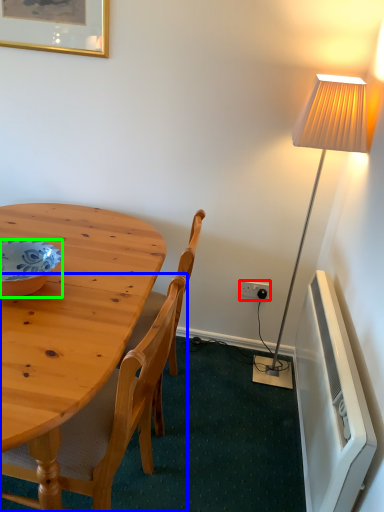
Question: Estimate the real-world distances between objects in this image. Which object is farther from power outlet (highlighted by a red box), chair (highlighted by a blue box) or bowl (highlighted by a green box)?

Choices:
 (A) chair
 (B) bowl

Answer: (B)